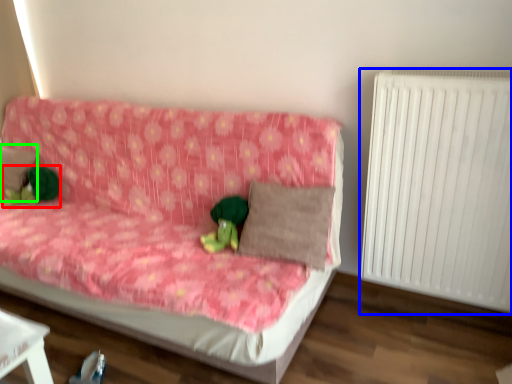
Question: Which object is the farthest from toy (highlighted by a red box)? Choose among these: radiator (highlighted by a blue box) or pillow (highlighted by a green box).

Choices:
 (A) radiator
 (B) pillow

Answer: (A)